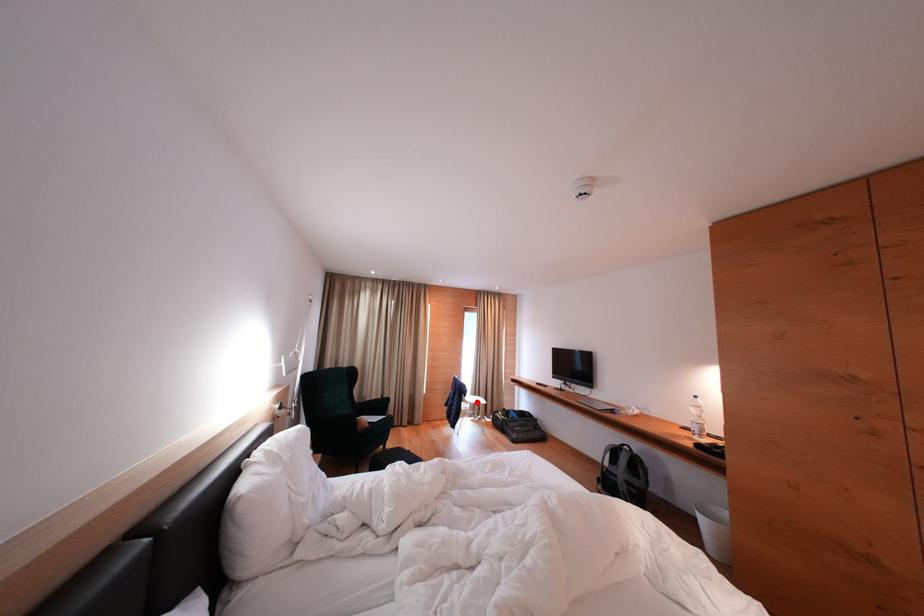
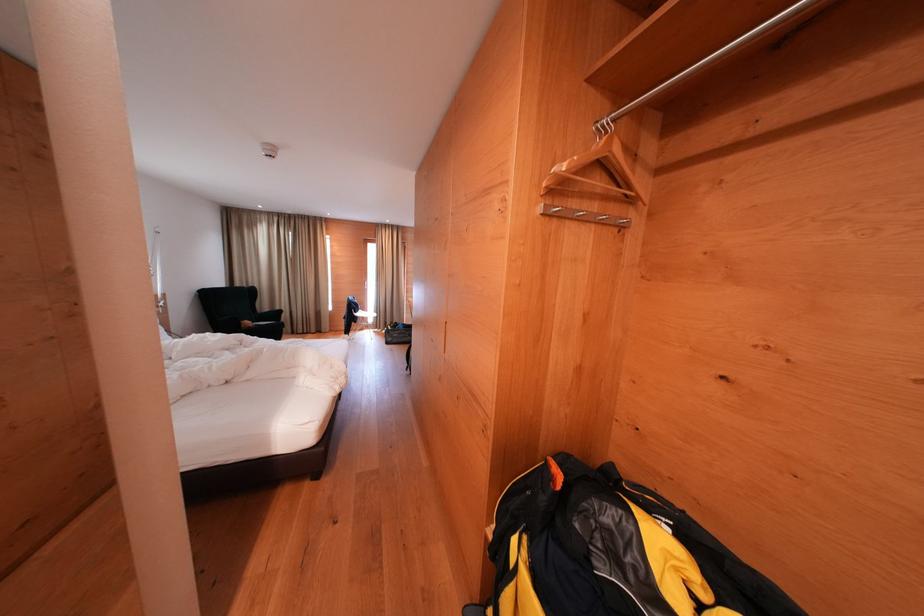
Question: I am providing you with two images of the same scene from different viewpoints. A red point is shown in image1. For the corresponding object point in image2, is it positioned nearer or farther from the camera?

Choices:
 (A) Nearer
 (B) Farther

Answer: (A)